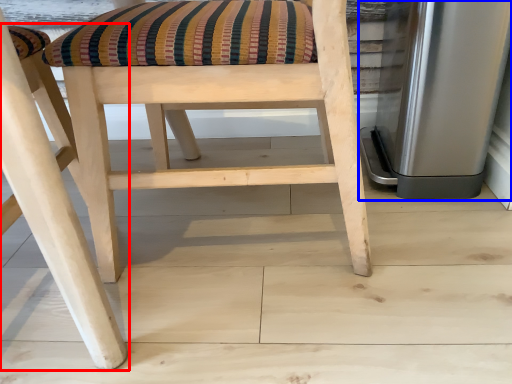
Question: Which object is further to the camera taking this photo, chair (highlighted by a red box) or appliance (highlighted by a blue box)?

Choices:
 (A) chair
 (B) appliance

Answer: (B)